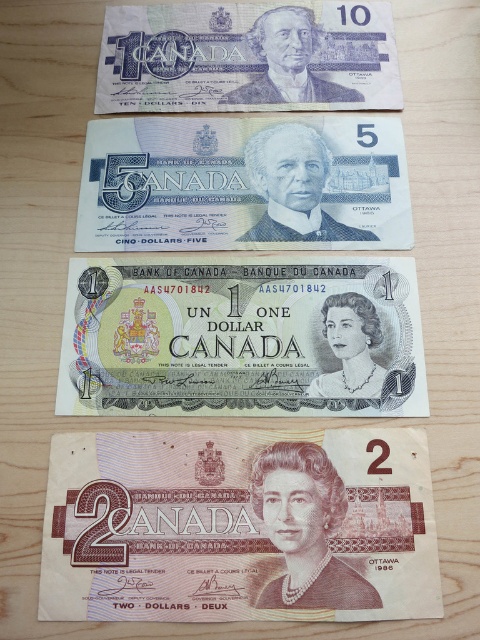
Question: Which object is positioned farthest from the matte purple banknote at upper center?

Choices:
 (A) light green paper at center
 (B) light brown paper money at bottom

Answer: (B)

Question: Based on their relative distances, which object is nearer to the light green paper at center?

Choices:
 (A) matte purple banknote at upper center
 (B) light brown paper money at bottom

Answer: (B)

Question: Can you confirm if light green paper at center is smaller than matte purple banknote at upper center?

Choices:
 (A) yes
 (B) no

Answer: (A)

Question: Considering the real-world distances, which object is farthest from the blue paper money at center?

Choices:
 (A) matte purple banknote at upper center
 (B) light green paper at center

Answer: (B)

Question: In this image, where is light brown paper money at bottom located relative to matte purple banknote at upper center?

Choices:
 (A) below
 (B) above

Answer: (A)

Question: Is light brown paper money at bottom smaller than light green paper at center?

Choices:
 (A) no
 (B) yes

Answer: (B)